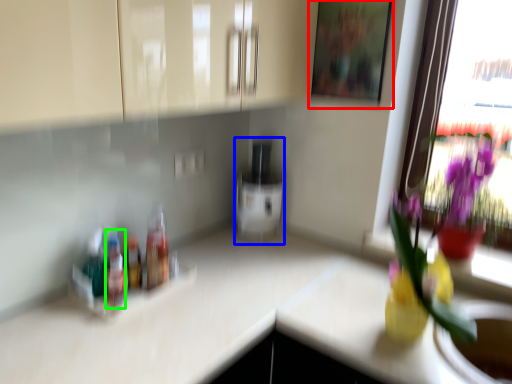
Question: Considering the real-world distances, which object is closest to picture frame (highlighted by a red box)? appliance (highlighted by a blue box) or bottle (highlighted by a green box).

Choices:
 (A) appliance
 (B) bottle

Answer: (A)